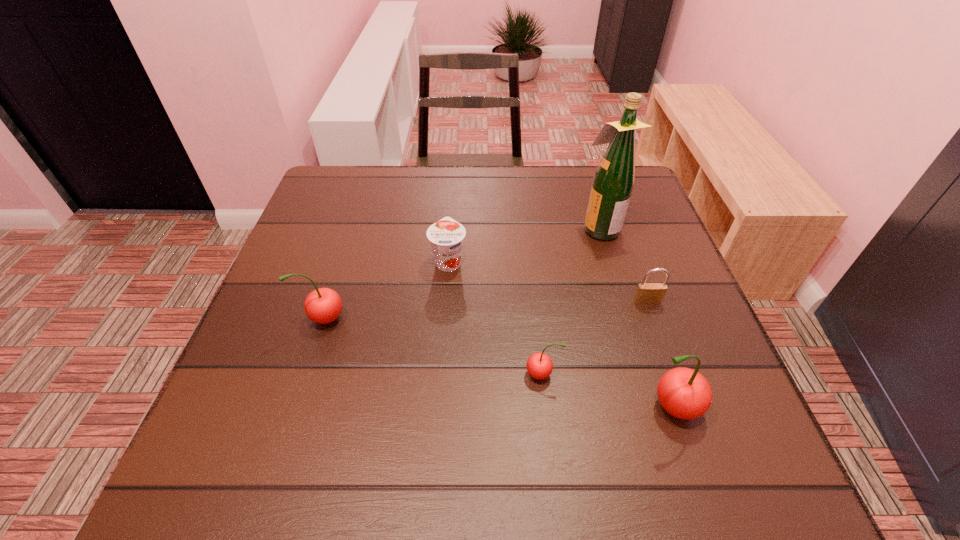
Locate an element on the screen. This screenshot has height=540, width=960. the second object from left to right is located at coordinates (446, 236).

Image resolution: width=960 pixels, height=540 pixels. I want to click on vacant space located 0.230m on the back of the farthest cherry, so click(351, 236).

At what (x,y) coordinates should I click in order to perform the action: click on vacant space located on the back of the fourth object from right to left. Please return your answer as a coordinate pair (x, y). Looking at the image, I should click on (538, 338).

You are a GUI agent. You are given a task and a screenshot of the screen. Output one action in this format:
    pyautogui.click(x=<x>, y=<y>)
    Task: Click on the vacant space situated on the left of the nearest object
    
    Given the screenshot: What is the action you would take?
    pyautogui.click(x=588, y=407)

The height and width of the screenshot is (540, 960). What are the coordinates of `vacant space located 0.230m on the front-facing side of the fourth nearest object` in the screenshot? It's located at [684, 403].

At what (x,y) coordinates should I click in order to perform the action: click on free location located 0.380m on the front-facing side of the liquor. Please return your answer as a coordinate pair (x, y). Looking at the image, I should click on (429, 228).

Identify the location of free region located on the front-facing side of the liquor. (457, 228).

You are a GUI agent. You are given a task and a screenshot of the screen. Output one action in this format:
    pyautogui.click(x=<x>, y=<y>)
    Task: Click on the vacant area situated on the front-facing side of the liquor
    
    Given the screenshot: What is the action you would take?
    pyautogui.click(x=504, y=228)

I want to click on blank space located on the front of the second farthest object, so click(x=439, y=395).

You are a GUI agent. You are given a task and a screenshot of the screen. Output one action in this format:
    pyautogui.click(x=<x>, y=<y>)
    Task: Click on the object present at the far edge
    The width and height of the screenshot is (960, 540).
    Given the screenshot: What is the action you would take?
    pyautogui.click(x=613, y=182)